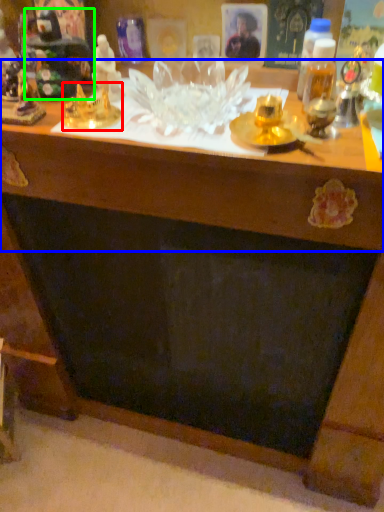
Question: Which is farther away from toy (highlighted by a red box)? table (highlighted by a blue box) or toy (highlighted by a green box)?

Choices:
 (A) table
 (B) toy

Answer: (A)